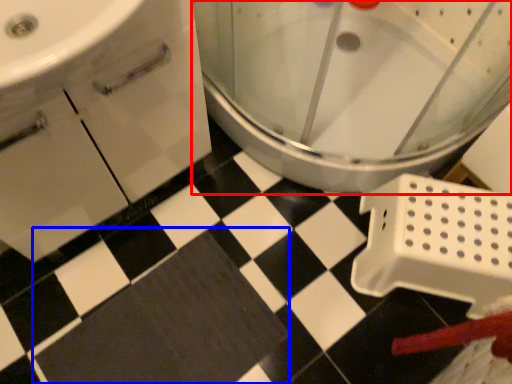
Question: Which point is further to the camera, toilet (highlighted by a red box) or bath mat (highlighted by a blue box)?

Choices:
 (A) toilet
 (B) bath mat

Answer: (B)